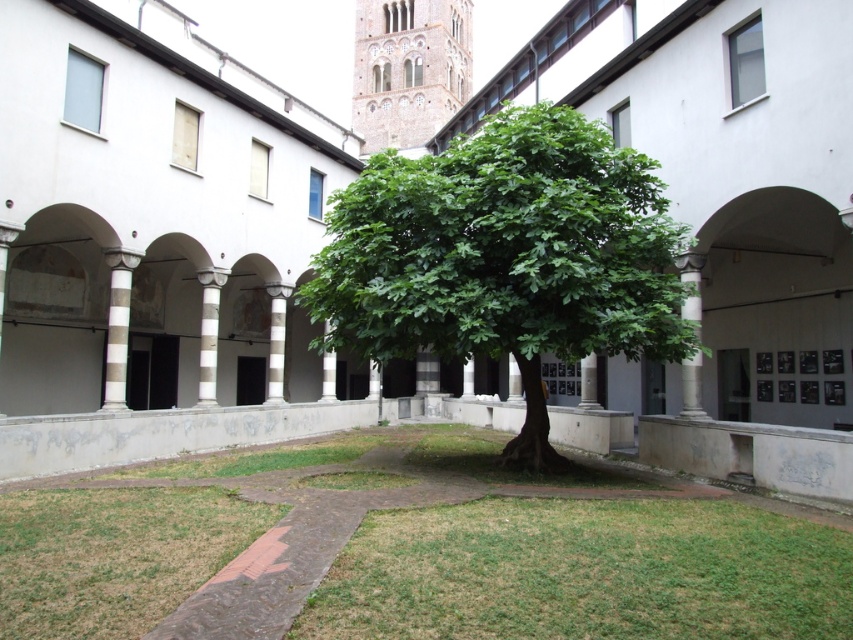
You are standing in the courtyard and notice two points marked on the ground. One is at coordinates point [698,412] and the other is at point [334,387]. Which point is closer to you?

Point [698,412] is closer to the viewer than point [334,387].